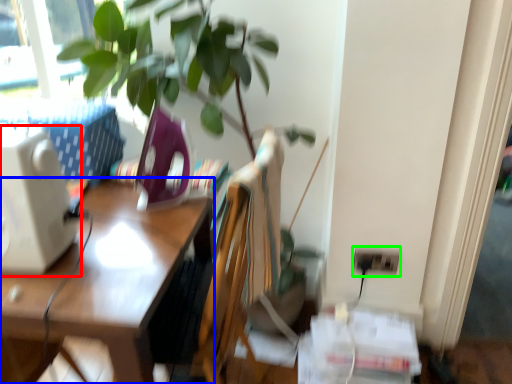
Question: Based on their relative distances, which object is nearer to desktop computer (highlighted by a red box)? Choose from desk (highlighted by a blue box) and electric outlet (highlighted by a green box).

Choices:
 (A) desk
 (B) electric outlet

Answer: (A)